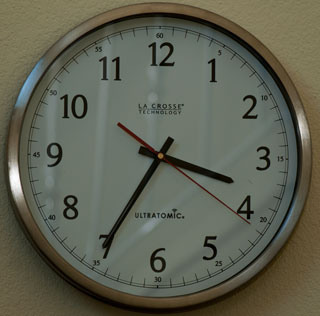
Where is `metal rim of clock`? This screenshot has width=320, height=316. metal rim of clock is located at coordinates (307, 152).